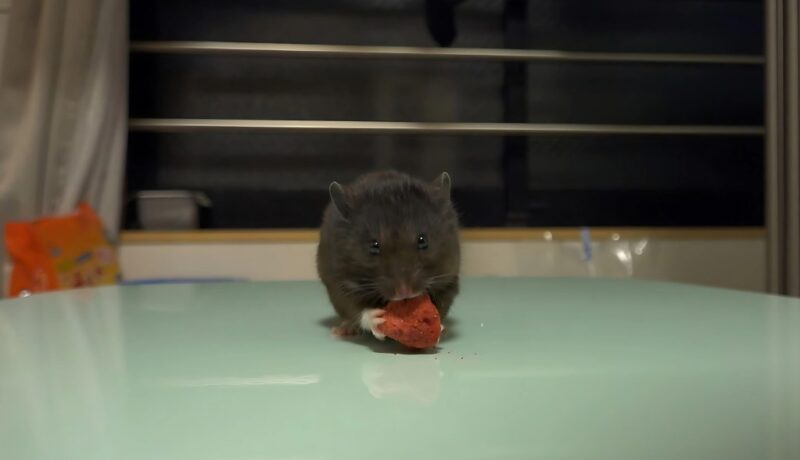
This screenshot has height=460, width=800. What are the coordinates of `curtain` in the screenshot? It's located at (94, 100).